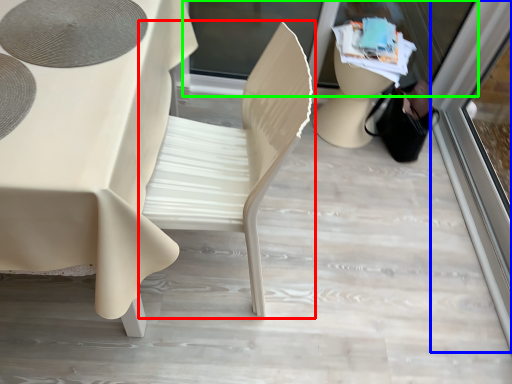
Question: Which is nearer to the chair (highlighted by a red box)? screen door (highlighted by a blue box) or shop window (highlighted by a green box).

Choices:
 (A) screen door
 (B) shop window

Answer: (B)